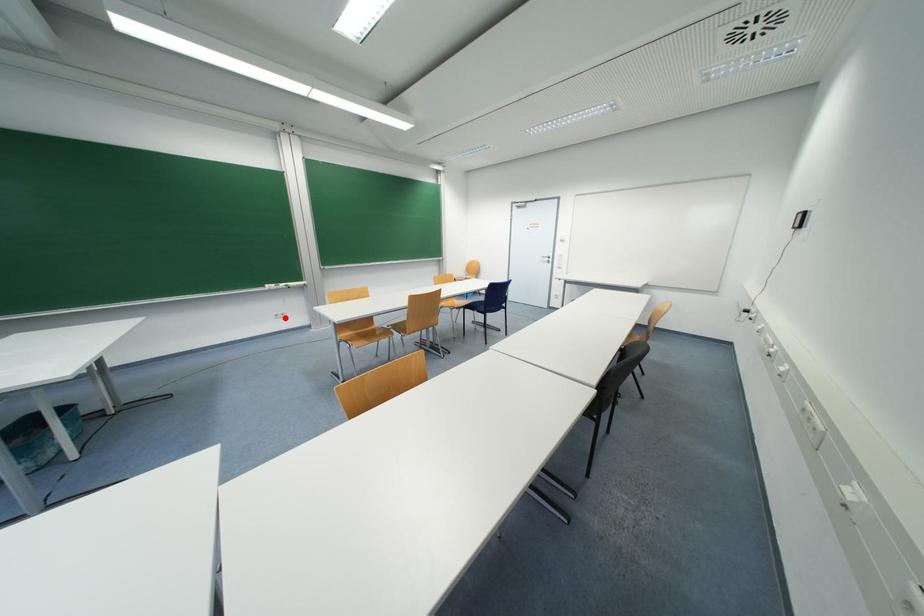
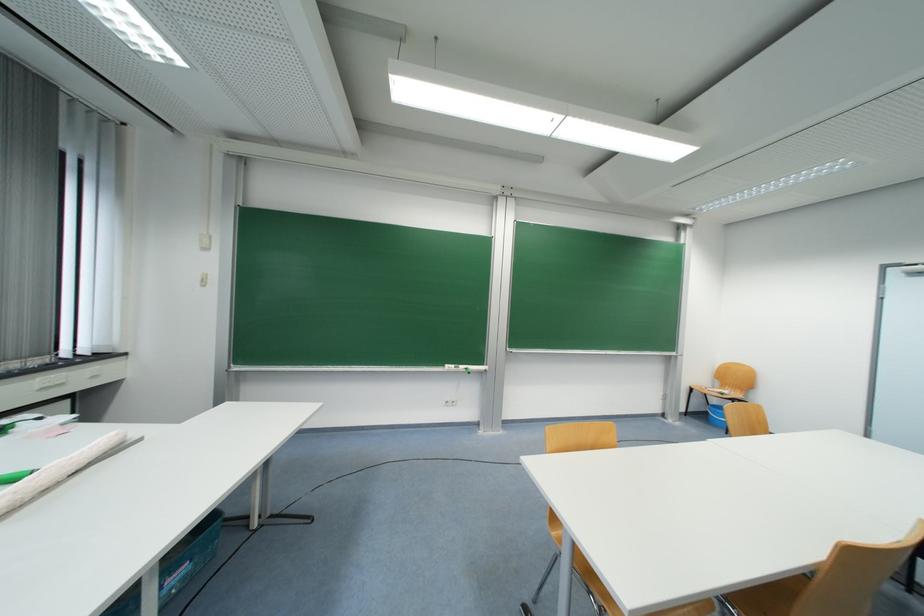
Question: I am providing you with two images of the same scene from different viewpoints. Given a red point in image1, look at the same physical point in image2. Is it:

Choices:
 (A) Closer to the viewpoint
 (B) Farther from the viewpoint

Answer: (B)